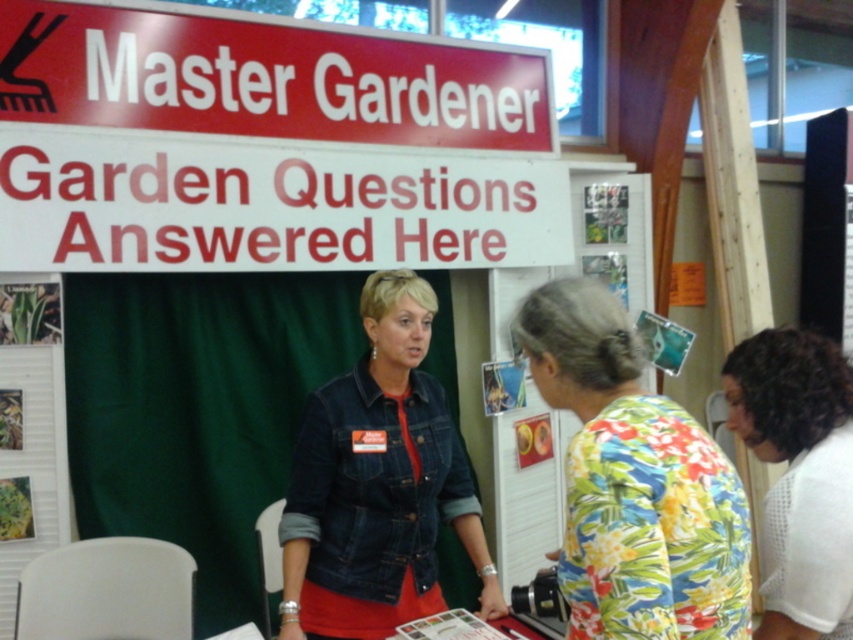
Question: Which of these objects is positioned closest to the green leafy poster at upper left?

Choices:
 (A) green matte plant at center
 (B) floral print blouse at lower right
 (C) floral fabric bulletin board at center

Answer: (A)

Question: Is white plastic sign at upper center in front of floral print blouse at lower right?

Choices:
 (A) no
 (B) yes

Answer: (A)

Question: Which of these objects is positioned farthest from the green matte plant at center?

Choices:
 (A) green leafy poster at upper left
 (B) white plastic sign at upper center
 (C) floral print blouse at lower right
 (D) denim jacket at center

Answer: (C)

Question: Considering the relative positions of floral print shirt at center and green matte plant at center in the image provided, where is floral print shirt at center located with respect to green matte plant at center?

Choices:
 (A) left
 (B) right

Answer: (B)

Question: Among these points, which one is farthest from the camera?

Choices:
 (A) (125, 74)
 (B) (367, 454)
 (C) (640, 512)

Answer: (A)

Question: Can you confirm if white plastic sign at upper center is positioned below denim jacket at center?

Choices:
 (A) no
 (B) yes

Answer: (A)